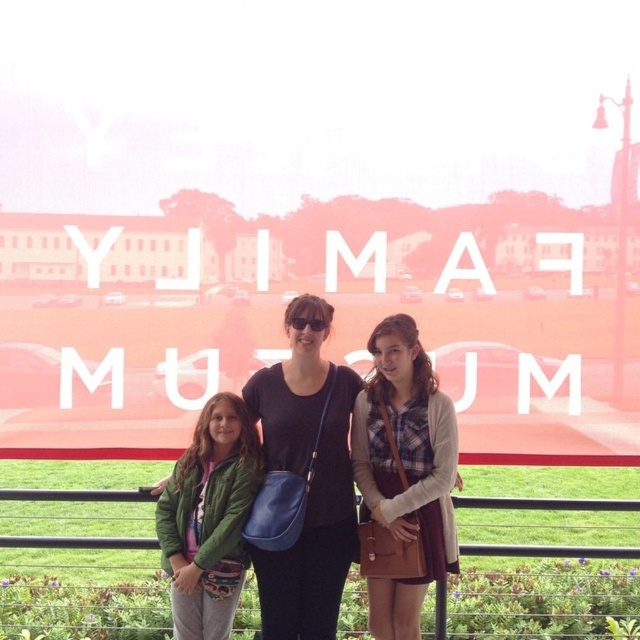
Between plaid shirt at center and metallic wire fence at center, which one appears on the left side from the viewer's perspective?

plaid shirt at center is more to the left.

Which is in front, point (376, 403) or point (35, 492)?

Point (376, 403) is more forward.

Does point (362, 509) come closer to viewer compared to point (51, 496)?

Yes, it is.

Where is `plaid shirt at center`? The image size is (640, 640). plaid shirt at center is located at coordinates (403, 477).

Measure the distance between point (440, 609) and camera.

Point (440, 609) is 5.77 meters away from camera.

Which is above, metallic wire fence at center or matte black shirt at center?

matte black shirt at center is above.

The width and height of the screenshot is (640, 640). Find the location of `metallic wire fence at center`. metallic wire fence at center is located at coordinates coord(547,502).

Between plaid shirt at center and matte black shirt at center, which one is positioned lower?

plaid shirt at center is below.

Can you confirm if plaid shirt at center is thinner than matte black shirt at center?

Yes.

The width and height of the screenshot is (640, 640). Find the location of `plaid shirt at center`. plaid shirt at center is located at coordinates (403, 477).